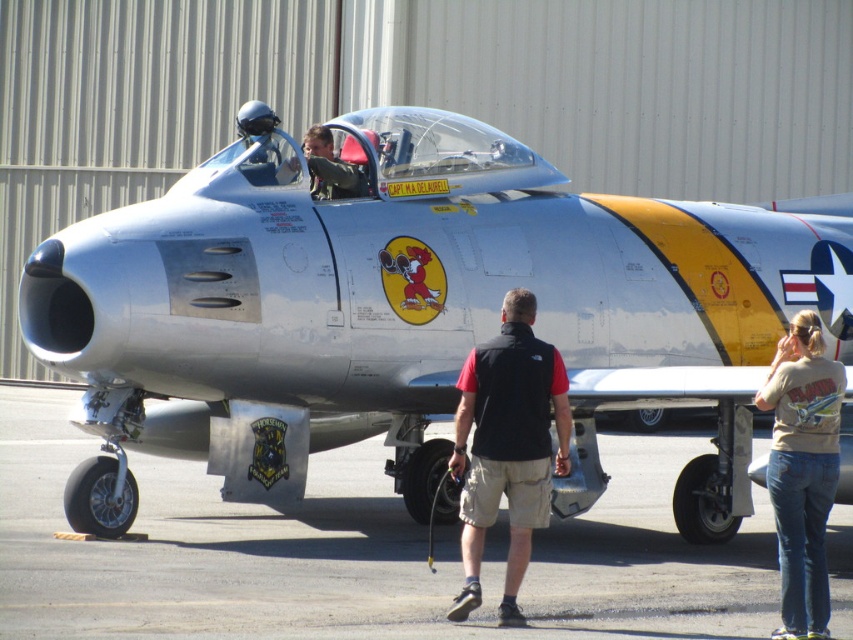
In the scene shown: You are standing near the vintage military jet and want to place a small object on the smooth asphalt tarmac at center and the tan cotton shirt at lower right. Which surface is closer to you where you can easily reach?

The smooth asphalt tarmac at center is closer to the viewer than the tan cotton shirt at lower right, so you can easily reach it.

You are standing in front of the vintage military jet and want to locate two specific points marked on the aircraft. The first point is at coordinates point [346,496] and the second is at point [827,620]. Which of these points is closer to you?

Point [346,496] is closer to you because it is further to the viewer than point [827,620].

You are a costume designer preparing for a historical military play. You have two items in the scene, the black fabric vest at center and the tan cotton shirt at lower right. Which item should you choose if you need a garment that is more compact and easier to move in?

The black fabric vest at center has a smaller size compared to the tan cotton shirt at lower right, so it is more compact and easier to move in.